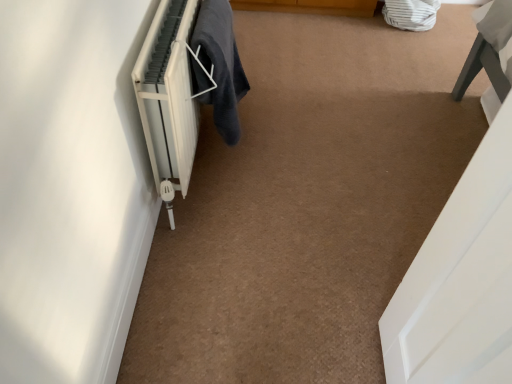
This screenshot has width=512, height=384. What do you see at coordinates (220, 65) in the screenshot?
I see `dark gray fabric at lower left` at bounding box center [220, 65].

Identify the location of dark gray fabric at lower left. The width and height of the screenshot is (512, 384). (220, 65).

In order to face white matte radiator at left, should I rotate leftwards or rightwards?

You should rotate left by 7.363 degrees.

Image resolution: width=512 pixels, height=384 pixels. Find the location of `white matte radiator at left`. white matte radiator at left is located at coordinates (168, 99).

This screenshot has height=384, width=512. What do you see at coordinates (168, 99) in the screenshot?
I see `white matte radiator at left` at bounding box center [168, 99].

The image size is (512, 384). I want to click on dark gray fabric at lower left, so click(220, 65).

Which object is positioned more to the right, white matte radiator at left or dark gray fabric at lower left?

Positioned to the right is dark gray fabric at lower left.

Is the depth of white matte radiator at left greater than that of dark gray fabric at lower left?

No, the depth of white matte radiator at left is less than that of dark gray fabric at lower left.

Is point (189, 49) less distant than point (203, 100)?

Yes, point (189, 49) is closer to viewer.

From the image's perspective, is white matte radiator at left beneath dark gray fabric at lower left?

Correct, white matte radiator at left appears lower than dark gray fabric at lower left in the image.

From a real-world perspective, which is physically below, white matte radiator at left or dark gray fabric at lower left?

white matte radiator at left, from a real-world perspective.

Is white matte radiator at left wider than dark gray fabric at lower left?

Yes.

Considering the relative sizes of white matte radiator at left and dark gray fabric at lower left in the image provided, is white matte radiator at left shorter than dark gray fabric at lower left?

In fact, white matte radiator at left may be taller than dark gray fabric at lower left.

In terms of size, does white matte radiator at left appear bigger or smaller than dark gray fabric at lower left?

white matte radiator at left is bigger than dark gray fabric at lower left.

Is white matte radiator at left inside the boundaries of dark gray fabric at lower left, or outside?

white matte radiator at left is located beyond the bounds of dark gray fabric at lower left.

Is white matte radiator at left not close to dark gray fabric at lower left?

They are positioned close to each other.

Is white matte radiator at left oriented away from dark gray fabric at lower left?

Yes.

Find the location of a particular element. The image size is (512, 384). radiator beneath the dark gray fabric at lower left (from a real-world perspective) is located at coordinates (168, 99).

Is dark gray fabric at lower left to the right of white matte radiator at left from the viewer's perspective?

Yes.

Is dark gray fabric at lower left positioned before white matte radiator at left?

No, dark gray fabric at lower left is further to the viewer.

Does point (201, 57) come behind point (173, 2)?

Yes, it is behind point (173, 2).

From the image's perspective, which one is positioned higher, dark gray fabric at lower left or white matte radiator at left?

dark gray fabric at lower left appears higher in the image.

From a real-world perspective, which object stands above the other?

dark gray fabric at lower left is physically above.

In terms of width, does dark gray fabric at lower left look wider or thinner when compared to white matte radiator at left?

Considering their sizes, dark gray fabric at lower left looks slimmer than white matte radiator at left.

Who is shorter, dark gray fabric at lower left or white matte radiator at left?

Standing shorter between the two is dark gray fabric at lower left.

Is dark gray fabric at lower left smaller than white matte radiator at left?

Correct, dark gray fabric at lower left occupies less space than white matte radiator at left.

Is dark gray fabric at lower left not inside white matte radiator at left?

That's incorrect, dark gray fabric at lower left is not completely outside white matte radiator at left.

Is dark gray fabric at lower left next to white matte radiator at left?

They are not placed beside each other.

Based on the photo, is dark gray fabric at lower left oriented away from white matte radiator at left?

That's right, dark gray fabric at lower left is facing away from white matte radiator at left.

How different are the orientations of dark gray fabric at lower left and white matte radiator at left in degrees?

The facing directions of dark gray fabric at lower left and white matte radiator at left are 0.00375 degrees apart.

Measure the distance from dark gray fabric at lower left to white matte radiator at left.

dark gray fabric at lower left is 7.33 inches away from white matte radiator at left.

Locate an element on the screen. This screenshot has height=384, width=512. laundry on the right of the white matte radiator at left is located at coordinates (220, 65).

Where is `radiator below the dark gray fabric at lower left (from a real-world perspective)`? The image size is (512, 384). radiator below the dark gray fabric at lower left (from a real-world perspective) is located at coordinates (168, 99).

This screenshot has height=384, width=512. What are the coordinates of `radiator in front of the dark gray fabric at lower left` in the screenshot? It's located at (168, 99).